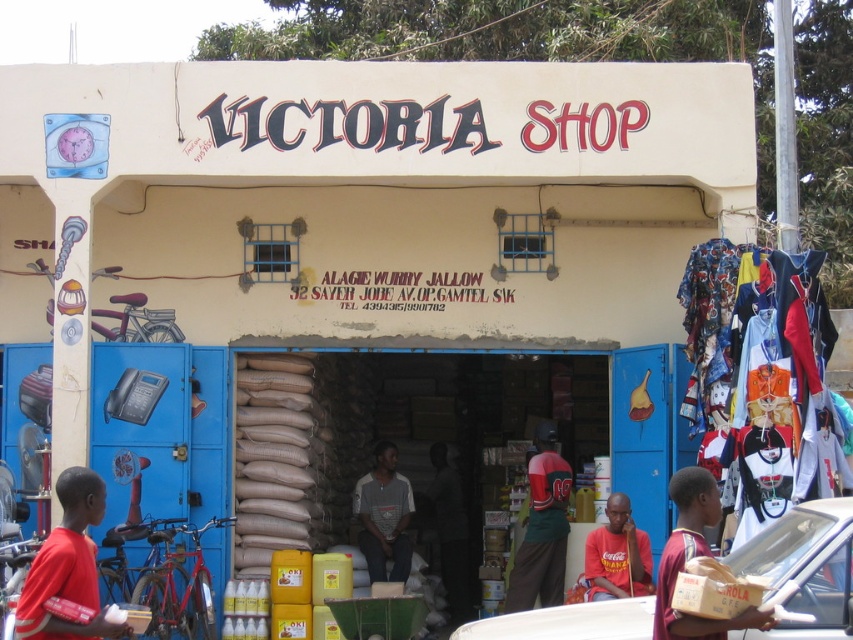
Question: Which point is closer to the camera?

Choices:
 (A) white plastic car at lower right
 (B) red matte shirt at left
 (C) green jersey at center

Answer: (A)

Question: Among these objects, which one is nearest to the camera?

Choices:
 (A) green jersey at center
 (B) brown cardboard box at lower right
 (C) gray striped shirt at center
 (D) red matte shirt at left

Answer: (B)

Question: Does green jersey at center appear under cotton t-shirt at center?

Choices:
 (A) no
 (B) yes

Answer: (A)

Question: Which object is closer to the camera taking this photo?

Choices:
 (A) cotton t-shirt at center
 (B) green jersey at center
 (C) white plastic car at lower right
 (D) brown cardboard box at lower right

Answer: (D)

Question: Can you confirm if brown cardboard box at lower right is smaller than gray striped shirt at center?

Choices:
 (A) no
 (B) yes

Answer: (B)

Question: Is gray striped shirt at center wider than cotton t-shirt at center?

Choices:
 (A) yes
 (B) no

Answer: (A)